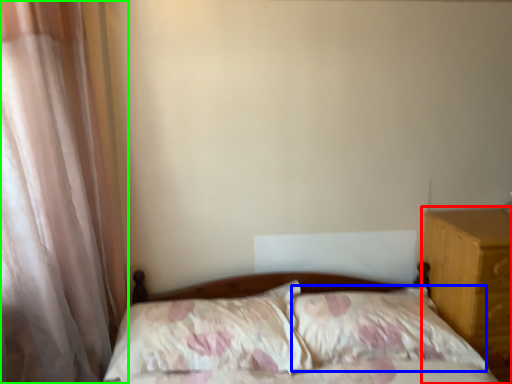
Question: Which is nearer to the nightstand (highlighted by a red box)? pillow (highlighted by a blue box) or curtain (highlighted by a green box).

Choices:
 (A) pillow
 (B) curtain

Answer: (A)